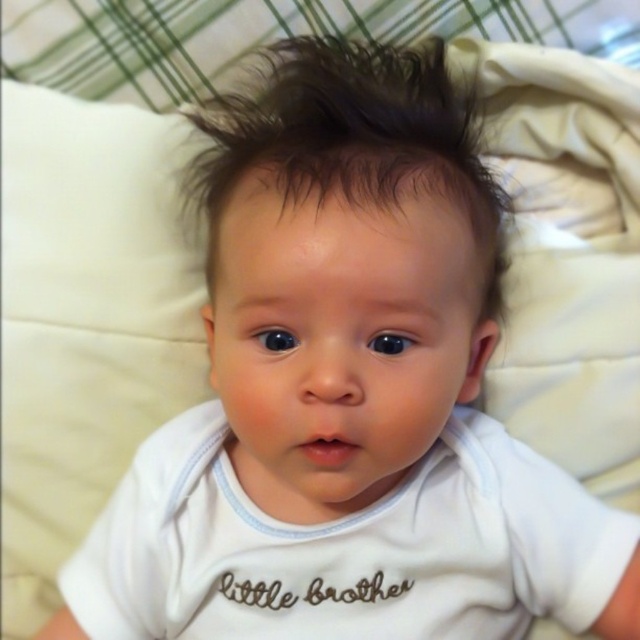
Question: Can you confirm if white soft fabric shirt at center is wider than dark brown shiny hair at center?

Choices:
 (A) no
 (B) yes

Answer: (B)

Question: Among these objects, which one is nearest to the camera?

Choices:
 (A) white soft fabric shirt at center
 (B) dark brown shiny hair at center

Answer: (B)

Question: Which object is farther from the camera taking this photo?

Choices:
 (A) dark brown shiny hair at center
 (B) white soft fabric shirt at center

Answer: (B)

Question: Can you confirm if white soft fabric shirt at center is bigger than dark brown shiny hair at center?

Choices:
 (A) no
 (B) yes

Answer: (A)

Question: Does white soft fabric shirt at center have a greater width compared to dark brown shiny hair at center?

Choices:
 (A) no
 (B) yes

Answer: (B)

Question: Which point is closer to the camera taking this photo?

Choices:
 (A) (200, 573)
 (B) (481, 180)

Answer: (B)